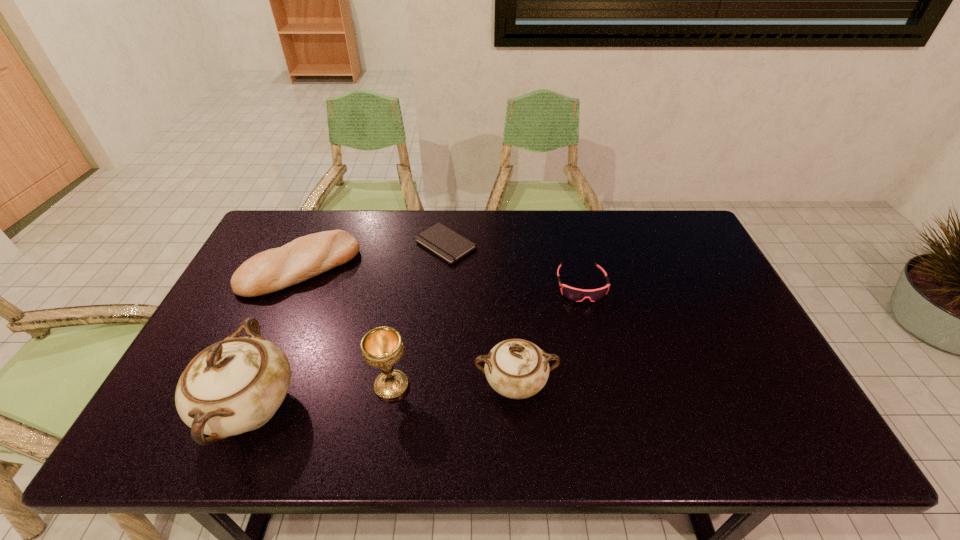
You are a GUI agent. You are given a task and a screenshot of the screen. Output one action in this format:
    pyautogui.click(x=<x>, y=<y>)
    Task: Click on the tallest object
    This screenshot has height=540, width=960.
    Given the screenshot: What is the action you would take?
    pyautogui.click(x=236, y=385)

The width and height of the screenshot is (960, 540). I want to click on the taller chinaware, so click(x=236, y=385).

The image size is (960, 540). Identify the location of the right chinaware. (515, 368).

Identify the location of the shortest object. tap(447, 244).

At what (x,y) coordinates should I click in order to perform the action: click on bread. Please return your answer as a coordinate pair (x, y). Looking at the image, I should click on (275, 269).

Find the location of a particular element. goggles is located at coordinates (578, 295).

Identify the location of the rightmost object. (578, 295).

What are the coordinates of `chalice` in the screenshot? It's located at (381, 347).

Locate an element on the screen. vacant area located 0.280m on the back of the tallest object is located at coordinates (304, 281).

Where is `free point located on the back of the right chinaware`? The image size is (960, 540). free point located on the back of the right chinaware is located at coordinates [x=507, y=268].